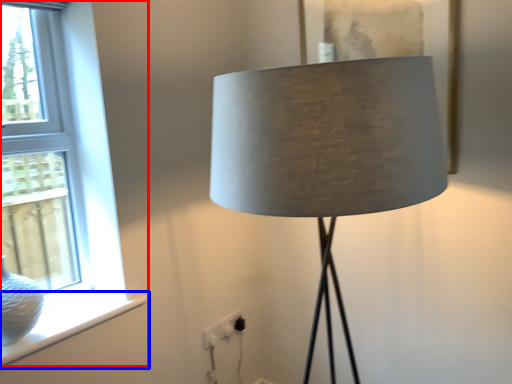
Question: Which object appears farthest to the camera in this image, window (highlighted by a red box) or window sill (highlighted by a blue box)?

Choices:
 (A) window
 (B) window sill

Answer: (B)